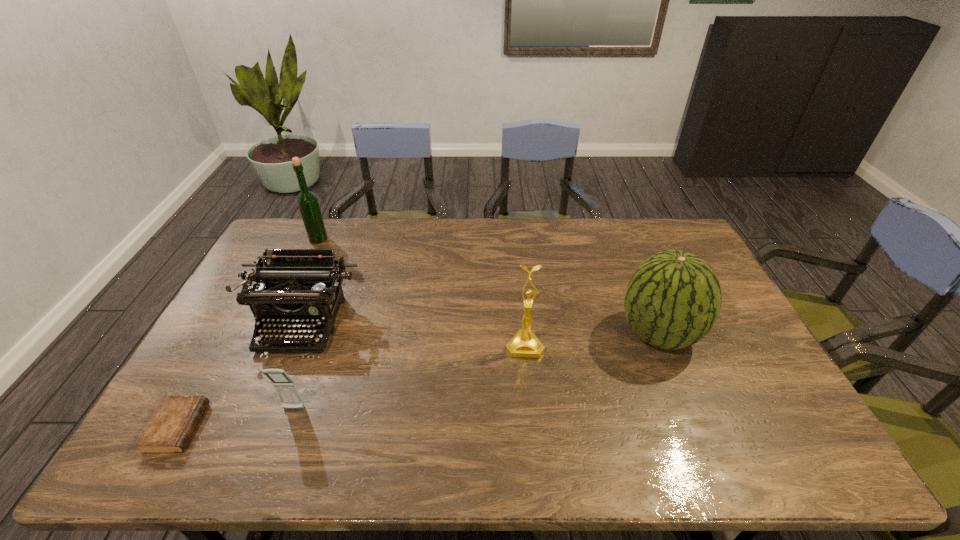
In the image, there is a desktop. Find the location of `vacant space at the far edge`. vacant space at the far edge is located at coordinates (433, 220).

This screenshot has width=960, height=540. Identify the location of free space at the near edge of the desktop. [x=443, y=451].

This screenshot has height=540, width=960. I want to click on vacant space at the left edge, so click(250, 326).

In order to click on vacant region at the far right corner of the desktop in this screenshot , I will do `click(669, 219)`.

Image resolution: width=960 pixels, height=540 pixels. In order to click on free spot between the award and the watermelon in this screenshot , I will do `click(591, 340)`.

Identify the location of free space between the award and the second shortest object. (409, 377).

Where is `vacant area that lies between the second shortest object and the fifth object from left to right`? Image resolution: width=960 pixels, height=540 pixels. vacant area that lies between the second shortest object and the fifth object from left to right is located at coordinates (409, 377).

Where is `vacant space in between the farthest object and the fifth object from left to right`? The height and width of the screenshot is (540, 960). vacant space in between the farthest object and the fifth object from left to right is located at coordinates (421, 292).

Locate an element on the screen. This screenshot has height=540, width=960. vacant space that is in between the shortest object and the award is located at coordinates 351,387.

At what (x,y) coordinates should I click in order to perform the action: click on free space between the fourth tallest object and the shortest object. Please return your answer as a coordinate pair (x, y). Looking at the image, I should click on (240, 375).